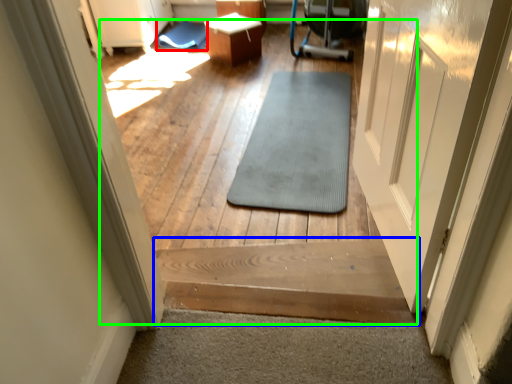
Question: Which is farther away from mat (highlighted by a red box)? stairs (highlighted by a blue box) or path (highlighted by a green box)?

Choices:
 (A) stairs
 (B) path

Answer: (A)